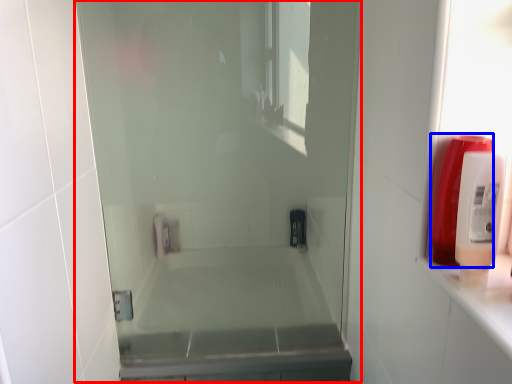
Question: Among these objects, which one is nearest to the camera, screen door (highlighted by a red box) or soap dispenser (highlighted by a blue box)?

Choices:
 (A) screen door
 (B) soap dispenser

Answer: (B)